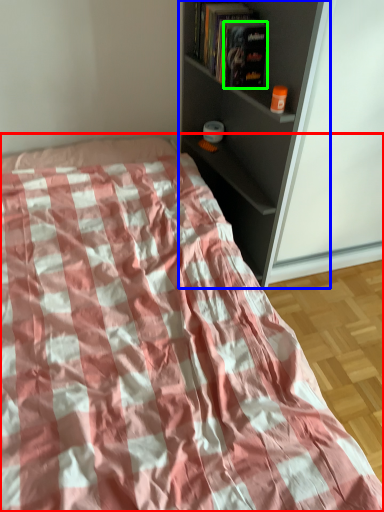
Question: Estimate the real-world distances between objects in this image. Which object is closer to bed (highlighted by a red box), shelf (highlighted by a blue box) or paperback book (highlighted by a green box)?

Choices:
 (A) shelf
 (B) paperback book

Answer: (A)